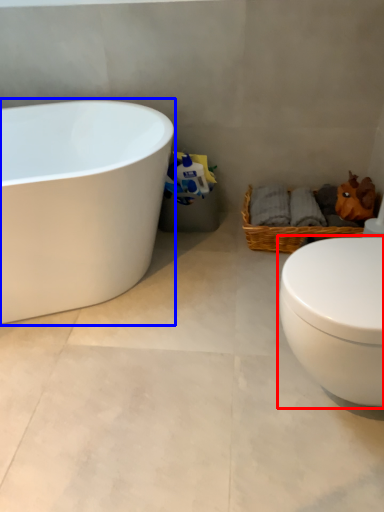
Question: Which object is closer to the camera taking this photo, toilet (highlighted by a red box) or bathtub (highlighted by a blue box)?

Choices:
 (A) toilet
 (B) bathtub

Answer: (A)